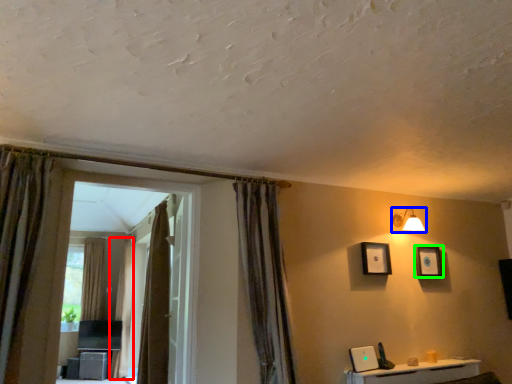
Question: Based on their relative distances, which object is nearer to curtain (highlighted by a red box)? Choose from light fixture (highlighted by a blue box) and picture frame (highlighted by a green box).

Choices:
 (A) light fixture
 (B) picture frame

Answer: (A)